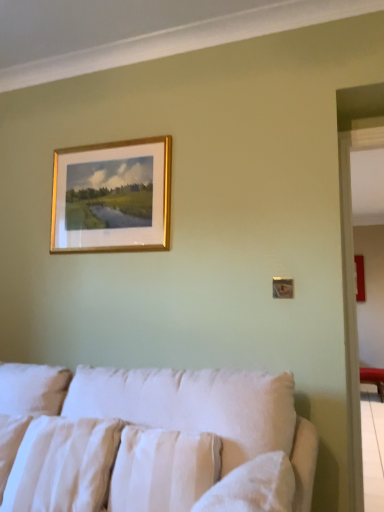
Find the location of `white fabric couch at lower center`. white fabric couch at lower center is located at coordinates (152, 441).

Locate an element on the screen. Image resolution: width=384 pixels, height=512 pixels. white textured pillow at lower center, arranged as the 1th pillow when viewed from the right is located at coordinates (163, 469).

In order to face white cotton pillow at lower left, acting as the 1th pillow starting from the left, should I rotate leftwards or rightwards?

To face it directly, rotate left by 17.491 degrees.

I want to click on white fabric couch at lower center, so click(x=152, y=441).

Which pillow is the 2nd one when counting from the back of the white fabric couch at lower center? Please provide its 2D coordinates.

[(63, 465)]

From the image's perspective, is white fabric couch at lower center located above white cotton pillow at lower left, acting as the 1th pillow starting from the left?

No.

Between white fabric couch at lower center and white cotton pillow at lower left, which is the 2th pillow in right-to-left order, which one has larger width?

Wider between the two is white fabric couch at lower center.

How different are the orientations of gold-framed painting at upper center and white cotton pillow at lower left, which is the 2th pillow in right-to-left order, in degrees?

gold-framed painting at upper center and white cotton pillow at lower left, which is the 2th pillow in right-to-left order, are facing 2.47 degrees away from each other.

Find the location of a particular element. The image size is (384, 512). pillow that is the 2nd one below the gold-framed painting at upper center (from a real-world perspective) is located at coordinates (63, 465).

Which is in front, point (143, 240) or point (39, 441)?

The point (39, 441) is closer to the camera.

Is gold-framed painting at upper center turned away from white cotton pillow at lower left, acting as the 1th pillow starting from the left?

gold-framed painting at upper center does not have its back to white cotton pillow at lower left, acting as the 1th pillow starting from the left.

In the image, there is a white textured pillow at lower center, arranged as the 1th pillow when viewed from the right. Where is `pillow below it (from a real-world perspective)`? Image resolution: width=384 pixels, height=512 pixels. pillow below it (from a real-world perspective) is located at coordinates (63, 465).

Is white cotton pillow at lower left, acting as the 1th pillow starting from the left, located outside white textured pillow at lower center, arranged as the 1th pillow when viewed from the right?

Yes, white cotton pillow at lower left, acting as the 1th pillow starting from the left, is located beyond the bounds of white textured pillow at lower center, arranged as the 1th pillow when viewed from the right.

Is white cotton pillow at lower left, which is the 2th pillow in right-to-left order, facing towards white textured pillow at lower center, arranged as the 1th pillow when viewed from the right?

No, white cotton pillow at lower left, which is the 2th pillow in right-to-left order, is not facing towards white textured pillow at lower center, arranged as the 1th pillow when viewed from the right.

Is point (44, 424) closer to viewer compared to point (212, 434)?

No, (44, 424) is behind (212, 434).

From a real-world perspective, is white cotton pillow at lower left, acting as the 1th pillow starting from the left, physically located above or below gold-framed painting at upper center?

Clearly, from a real-world perspective, white cotton pillow at lower left, acting as the 1th pillow starting from the left, is below gold-framed painting at upper center.

Image resolution: width=384 pixels, height=512 pixels. I want to click on picture frame behind the white cotton pillow at lower left, which is the 2th pillow in right-to-left order, so click(112, 197).

Is white cotton pillow at lower left, acting as the 1th pillow starting from the left, positioned in front of gold-framed painting at upper center?

Yes, white cotton pillow at lower left, acting as the 1th pillow starting from the left, is closer to the viewer.

Which is more to the right, white cotton pillow at lower left, acting as the 1th pillow starting from the left, or gold-framed painting at upper center?

gold-framed painting at upper center.

Considering the relative positions of gold-framed painting at upper center and white textured pillow at lower center, the 2th pillow in the left-to-right sequence, in the image provided, is gold-framed painting at upper center to the left or to the right of white textured pillow at lower center, the 2th pillow in the left-to-right sequence,?

gold-framed painting at upper center is positioned on white textured pillow at lower center, the 2th pillow in the left-to-right sequence,'s left side.

Which is nearer, (59, 250) or (150, 486)?

Point (59, 250).

Is gold-framed painting at upper center aimed at white textured pillow at lower center, arranged as the 1th pillow when viewed from the right?

No, gold-framed painting at upper center does not turn towards white textured pillow at lower center, arranged as the 1th pillow when viewed from the right.

From the image's perspective, is gold-framed painting at upper center on top of white fabric couch at lower center?

Correct, gold-framed painting at upper center appears higher than white fabric couch at lower center in the image.

Do you think gold-framed painting at upper center is within white fabric couch at lower center, or outside of it?

gold-framed painting at upper center is spatially situated outside white fabric couch at lower center.

Between gold-framed painting at upper center and white fabric couch at lower center, which one is positioned behind?

gold-framed painting at upper center is further from the camera.

Where is `pillow on the right of white fabric couch at lower center`? Image resolution: width=384 pixels, height=512 pixels. pillow on the right of white fabric couch at lower center is located at coordinates (163, 469).

Which of these two, white textured pillow at lower center, arranged as the 1th pillow when viewed from the right, or white fabric couch at lower center, is wider?

With larger width is white fabric couch at lower center.

Based on the photo, considering the sizes of objects white textured pillow at lower center, the 2th pillow in the left-to-right sequence, and white fabric couch at lower center in the image provided, who is bigger, white textured pillow at lower center, the 2th pillow in the left-to-right sequence, or white fabric couch at lower center?

white fabric couch at lower center.

Locate an element on the screen. studio couch on the right of the white cotton pillow at lower left, which is the 2th pillow in right-to-left order is located at coordinates (152, 441).

Identify the location of picture frame above the white cotton pillow at lower left, acting as the 1th pillow starting from the left (from a real-world perspective). [112, 197].

Considering their positions, is gold-framed painting at upper center positioned closer to white cotton pillow at lower left, acting as the 1th pillow starting from the left, than white textured pillow at lower center, arranged as the 1th pillow when viewed from the right?

white textured pillow at lower center, arranged as the 1th pillow when viewed from the right.

When comparing their distances from white fabric couch at lower center, does gold-framed painting at upper center or white cotton pillow at lower left, acting as the 1th pillow starting from the left, seem further?

gold-framed painting at upper center is further to white fabric couch at lower center.

Which object lies nearer to the anchor point gold-framed painting at upper center, white textured pillow at lower center, the 2th pillow in the left-to-right sequence, or white fabric couch at lower center?

Among the two, white fabric couch at lower center is located nearer to gold-framed painting at upper center.

Estimate the real-world distances between objects in this image. Which object is closer to white fabric couch at lower center, white textured pillow at lower center, arranged as the 1th pillow when viewed from the right, or gold-framed painting at upper center?

Among the two, white textured pillow at lower center, arranged as the 1th pillow when viewed from the right, is located nearer to white fabric couch at lower center.

Which object lies nearer to the anchor point white textured pillow at lower center, the 2th pillow in the left-to-right sequence, white cotton pillow at lower left, which is the 2th pillow in right-to-left order, or white fabric couch at lower center?

Based on the image, white fabric couch at lower center appears to be nearer to white textured pillow at lower center, the 2th pillow in the left-to-right sequence.

From the image, which object appears to be nearer to gold-framed painting at upper center, white textured pillow at lower center, arranged as the 1th pillow when viewed from the right, or white cotton pillow at lower left, which is the 2th pillow in right-to-left order?

white cotton pillow at lower left, which is the 2th pillow in right-to-left order.

When comparing their distances from white textured pillow at lower center, arranged as the 1th pillow when viewed from the right, does white cotton pillow at lower left, acting as the 1th pillow starting from the left, or gold-framed painting at upper center seem further?

gold-framed painting at upper center lies further to white textured pillow at lower center, arranged as the 1th pillow when viewed from the right, than the other object.

Estimate the real-world distances between objects in this image. Which object is closer to white cotton pillow at lower left, which is the 2th pillow in right-to-left order, white textured pillow at lower center, the 2th pillow in the left-to-right sequence, or white fabric couch at lower center?

white fabric couch at lower center is positioned closer to the anchor white cotton pillow at lower left, which is the 2th pillow in right-to-left order.

This screenshot has height=512, width=384. What are the coordinates of `pillow between gold-framed painting at upper center and white cotton pillow at lower left, acting as the 1th pillow starting from the left, from top to bottom` in the screenshot? It's located at (163, 469).

You are a GUI agent. You are given a task and a screenshot of the screen. Output one action in this format:
    pyautogui.click(x=<x>, y=<y>)
    Task: Click on the pillow positioned between white fabric couch at lower center and white cotton pillow at lower left, acting as the 1th pillow starting from the left, from near to far
    The image size is (384, 512).
    Given the screenshot: What is the action you would take?
    pyautogui.click(x=163, y=469)